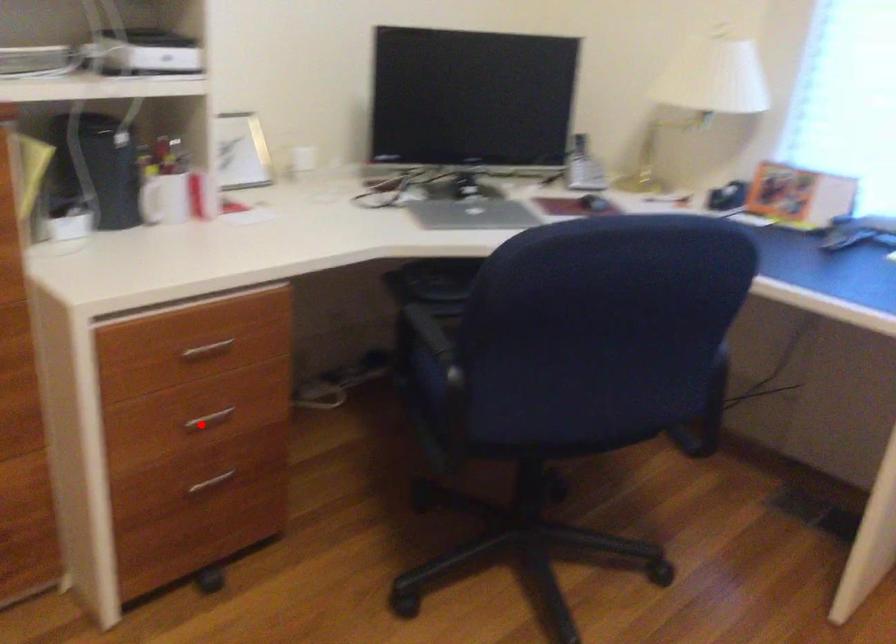
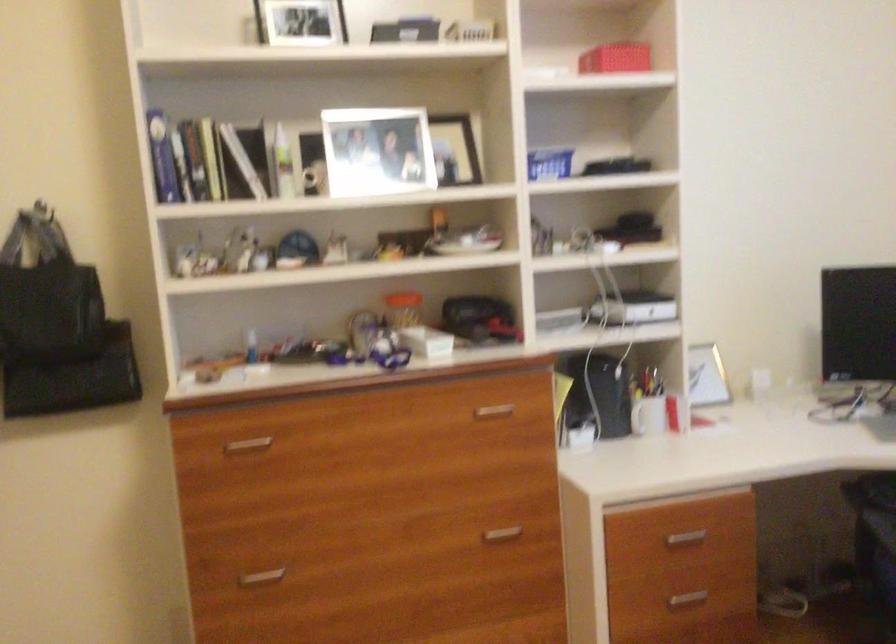
Question: A red point is marked in image1. In image2, is the corresponding 3D point closer to the camera or farther? Reply with the corresponding letter.

Choices:
 (A) The corresponding 3D point is closer.
 (B) The corresponding 3D point is farther.

Answer: (B)